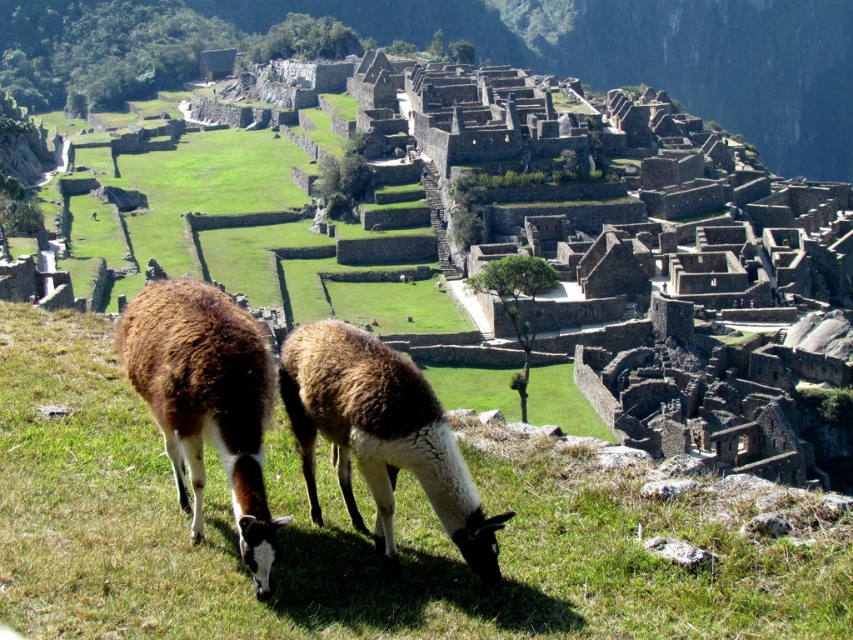
Can you confirm if green grass at center is taller than brown woolly alpaca at lower left?

Yes, green grass at center is taller than brown woolly alpaca at lower left.

Between green grass at center and brown woolly alpaca at lower left, which one appears on the left side from the viewer's perspective?

Positioned to the left is brown woolly alpaca at lower left.

This screenshot has height=640, width=853. I want to click on green grass at center, so click(x=364, y=538).

Does green grass at center appear on the left side of brown woolly alpaca at center?

Correct, you'll find green grass at center to the left of brown woolly alpaca at center.

Looking at this image, is green grass at center closer to camera compared to brown woolly alpaca at center?

Yes, green grass at center is in front of brown woolly alpaca at center.

Is point (189, 605) less distant than point (416, 424)?

That is True.

What are the coordinates of `green grass at center` in the screenshot? It's located at (364, 538).

Find the location of a particular element. The image size is (853, 640). brown woolly alpaca at center is located at coordinates (380, 435).

Is brown woolly alpaca at center taller than brown woolly alpaca at lower left?

No.

Who is more forward, (344, 416) or (236, 376)?

Point (236, 376) is more forward.

Locate an element on the screen. brown woolly alpaca at center is located at coordinates (380, 435).